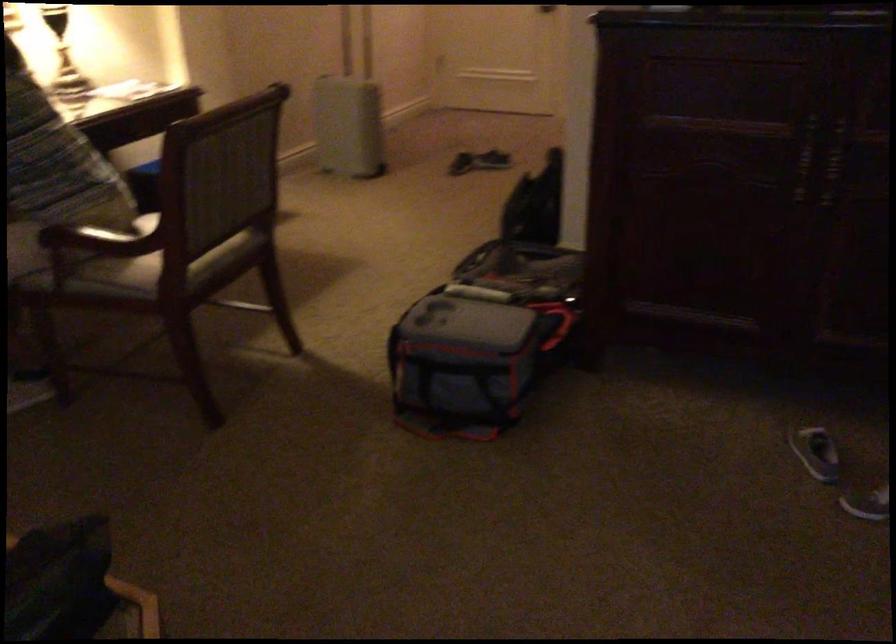
Image resolution: width=896 pixels, height=644 pixels. What do you see at coordinates (108, 238) in the screenshot?
I see `the chair armrest` at bounding box center [108, 238].